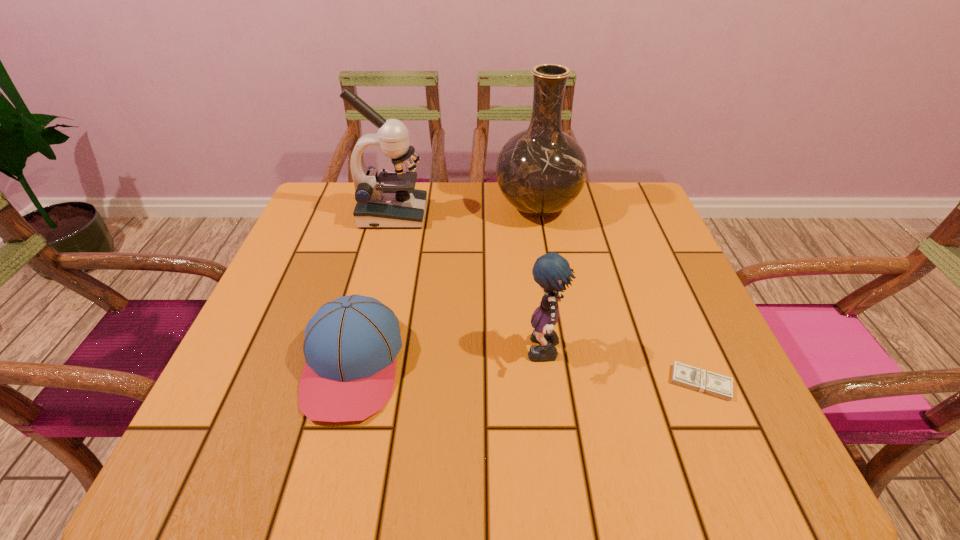
The width and height of the screenshot is (960, 540). I want to click on free spot between the vase and the microscope, so [x=465, y=211].

Locate an element on the screen. The width and height of the screenshot is (960, 540). free space between the microscope and the baseball cap is located at coordinates (372, 290).

At what (x,y) coordinates should I click in order to perform the action: click on free point between the third tallest object and the money. Please return your answer as a coordinate pair (x, y). The height and width of the screenshot is (540, 960). Looking at the image, I should click on (622, 368).

Where is `vacant point located between the vase and the rightmost object`? The image size is (960, 540). vacant point located between the vase and the rightmost object is located at coordinates (619, 295).

Where is `object that is the closest to the microscope`? The image size is (960, 540). object that is the closest to the microscope is located at coordinates (541, 170).

Select which object appears as the third closest to the vase. Please provide its 2D coordinates. Your answer should be formatted as a tuple, i.e. [(x, y)], where the tuple contains the x and y coordinates of a point satisfying the conditions above.

[(350, 346)]

Image resolution: width=960 pixels, height=540 pixels. I want to click on vacant area that satisfies the following two spatial constraints: 1. at the eyepiece of the rightmost object; 2. on the left side of the microscope, so click(351, 382).

Where is `free location that satisfies the following two spatial constraints: 1. on the front-facing side of the rightmost object; 2. on the right side of the fourth tallest object`? free location that satisfies the following two spatial constraints: 1. on the front-facing side of the rightmost object; 2. on the right side of the fourth tallest object is located at coordinates (348, 382).

The height and width of the screenshot is (540, 960). In order to click on vacant region that satisfies the following two spatial constraints: 1. on the front-facing side of the fourth tallest object; 2. on the right side of the rightmost object in this screenshot , I will do `click(348, 382)`.

Image resolution: width=960 pixels, height=540 pixels. I want to click on blank area in the image that satisfies the following two spatial constraints: 1. at the eyepiece of the microscope; 2. on the front-facing side of the second shortest object, so (x=355, y=365).